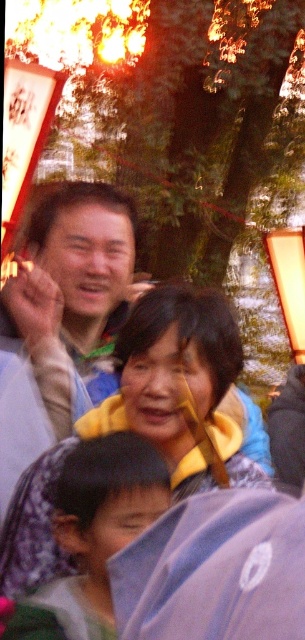
You are a photographer standing at the edge of the scene. You want to take a photo that includes both the matte gray shirt at center and the blue fabric umbrella at lower center. Considering their distance, will you need to zoom in or zoom out to capture both in the frame?

The matte gray shirt at center is 1.98 meters away from the blue fabric umbrella at lower center. Since they are relatively close to each other, you would likely need to zoom out to ensure both are in the frame.

You are standing at the edge of the festive event and see the matte gray shirt at center and the blue fabric umbrella at lower center. Which object is positioned higher from the ground?

The matte gray shirt at center is located above the blue fabric umbrella at lower center, so it is positioned higher from the ground.